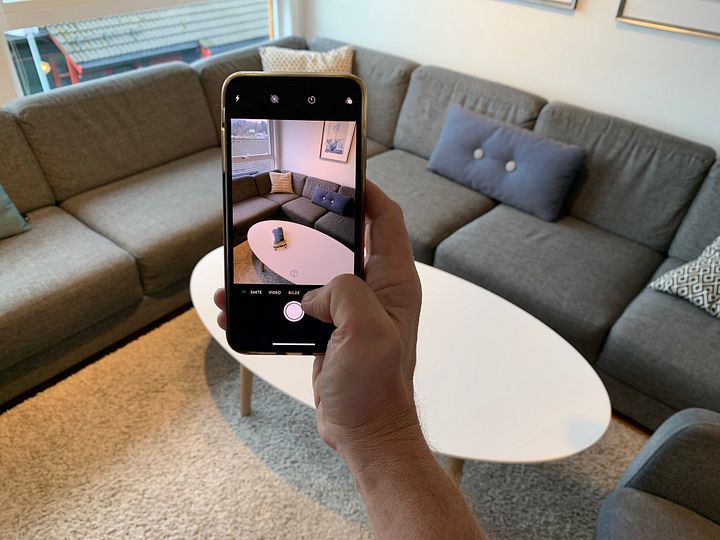
The image size is (720, 540). In order to click on beige carpet in this screenshot , I will do `click(225, 497)`.